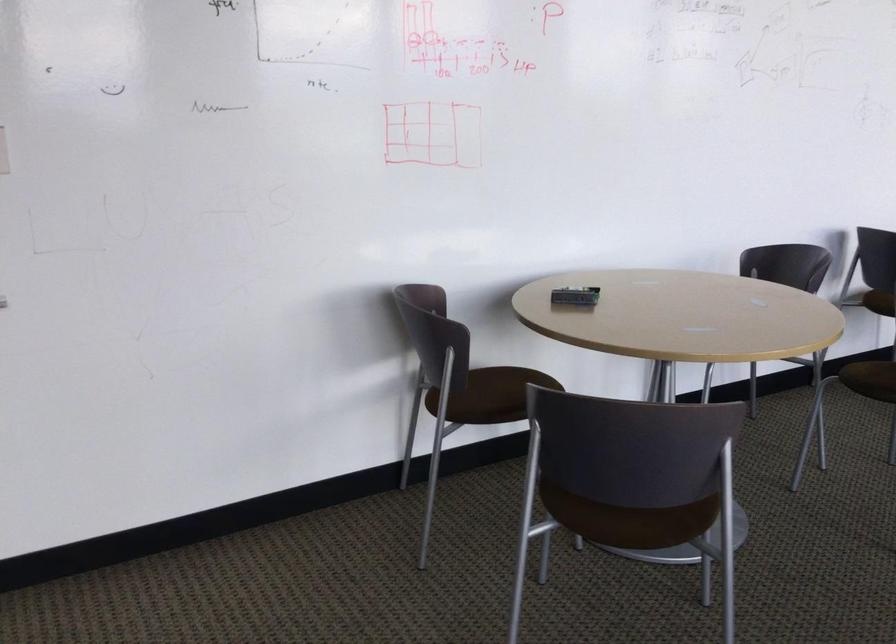
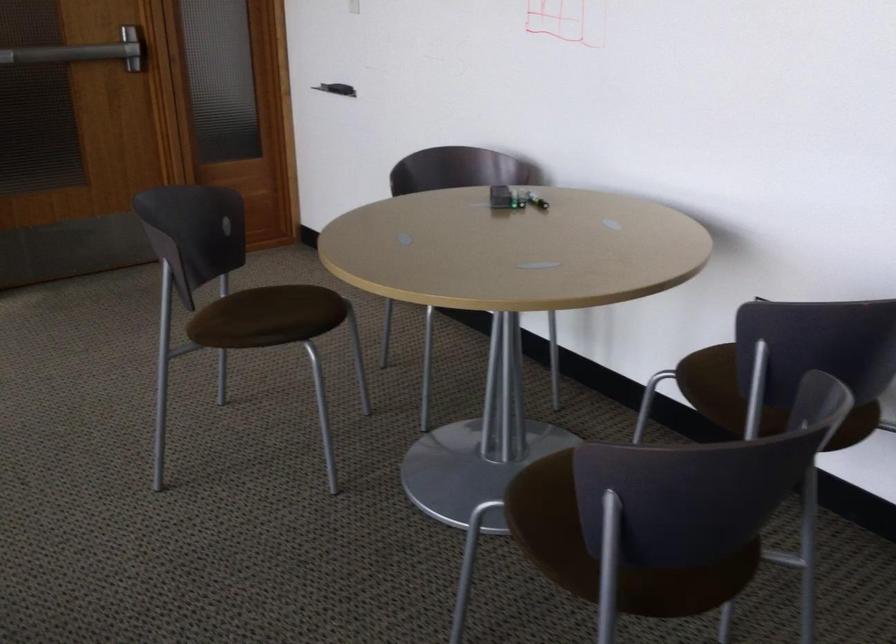
Question: I am providing you with two images of the same scene from different viewpoints. Please identify which objects are invisible in image2.

Choices:
 (A) whiteboard crank handle
 (B) silver door handle
 (C) black whiteboard eraser
 (D) chair sitting surface

Answer: (D)